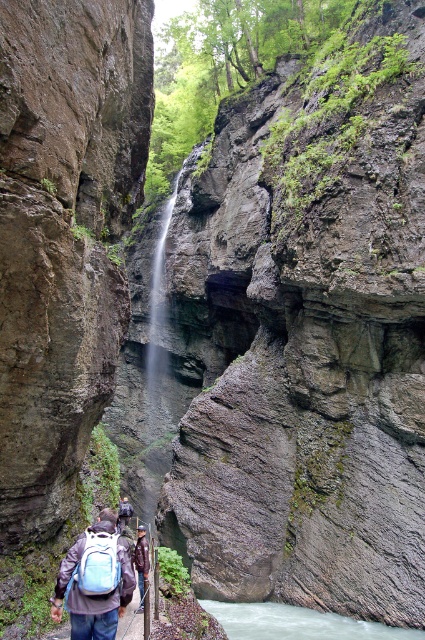
Question: Which of the following is the closest to the observer?

Choices:
 (A) (316, 634)
 (B) (104, 554)

Answer: (B)

Question: Which of the following is the closest to the observer?

Choices:
 (A) tap(147, 561)
 (B) tap(357, 628)
 (C) tap(70, 605)
 (D) tap(113, 570)

Answer: (C)

Question: Is blue backpack at center further to camera compared to light blue fabric backpack at lower center?

Choices:
 (A) yes
 (B) no

Answer: (A)

Question: Which of the following is the farthest from the observer?

Choices:
 (A) (112, 588)
 (B) (317, 634)

Answer: (B)

Question: Is blue backpack at center positioned in front of dark blue backpack at center?

Choices:
 (A) no
 (B) yes

Answer: (B)

Question: Is white smooth river at center thinner than blue backpack at center?

Choices:
 (A) no
 (B) yes

Answer: (A)